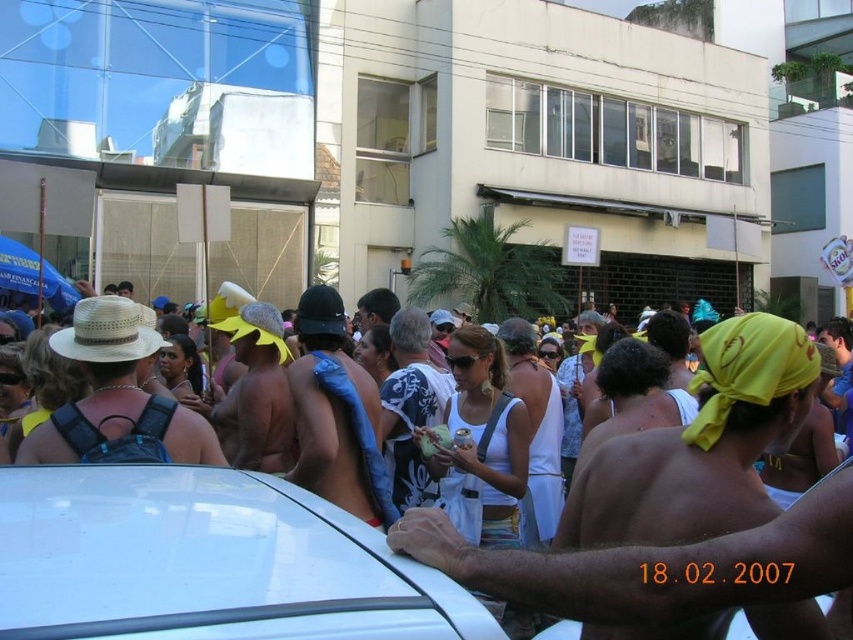
The height and width of the screenshot is (640, 853). Describe the element at coordinates (699, 445) in the screenshot. I see `yellow fabric headscarf at center-right` at that location.

Does point (737, 371) come farther from viewer compared to point (395, 388)?

No, it is not.

The height and width of the screenshot is (640, 853). I want to click on yellow fabric headscarf at center-right, so click(x=699, y=445).

Does white glossy car at lower left appear on the left side of yellow fabric headscarf at center-right?

Indeed, white glossy car at lower left is positioned on the left side of yellow fabric headscarf at center-right.

Does white glossy car at lower left have a greater height compared to yellow fabric headscarf at center-right?

No.

I want to click on white glossy car at lower left, so (x=206, y=561).

Which of these two, blue fabric at center or white printed shirt at center, stands shorter?

With less height is blue fabric at center.

Is blue fabric at center below white printed shirt at center?

Yes.

Where is `blue fabric at center`? This screenshot has height=640, width=853. blue fabric at center is located at coordinates (335, 416).

The image size is (853, 640). Find the location of `blue fabric at center`. blue fabric at center is located at coordinates (335, 416).